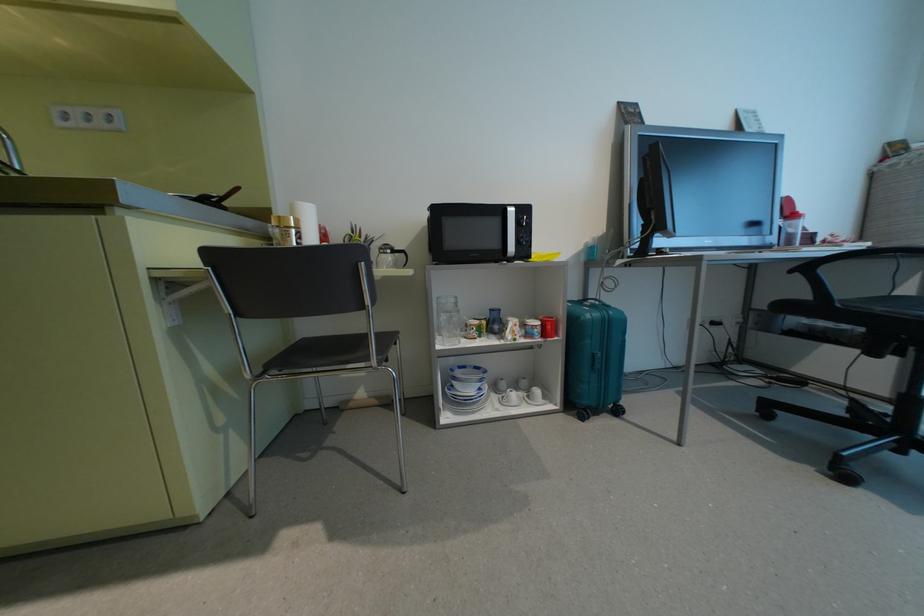
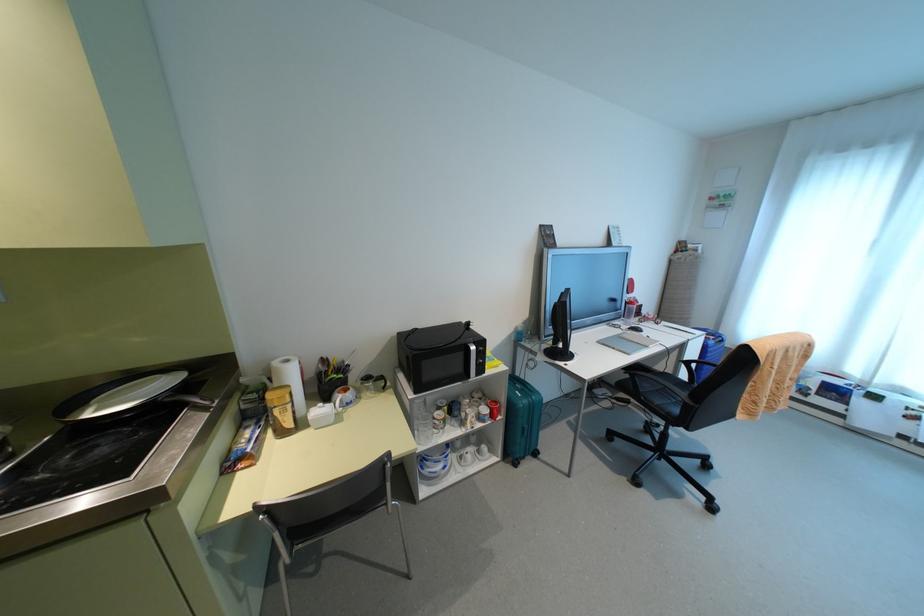
In the second image, find the point that corresponds to [616,411] in the first image.

(535, 454)